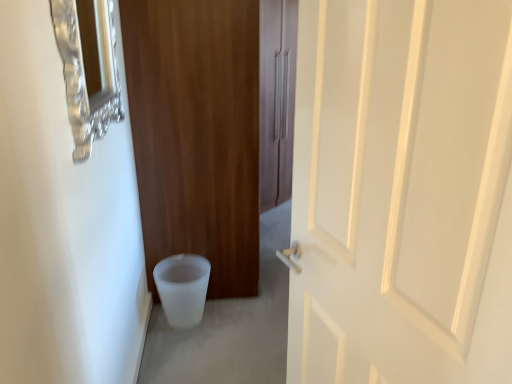
Question: Can you confirm if white frosted toilet bowl at lower left is smaller than matte wood door at center, acting as the second door starting from the front?

Choices:
 (A) no
 (B) yes

Answer: (B)

Question: Does white frosted toilet bowl at lower left have a greater width compared to matte wood door at center, acting as the first door starting from the back?

Choices:
 (A) no
 (B) yes

Answer: (A)

Question: Can you confirm if white frosted toilet bowl at lower left is bigger than matte wood door at center, acting as the second door starting from the front?

Choices:
 (A) no
 (B) yes

Answer: (A)

Question: Is white frosted toilet bowl at lower left positioned before matte wood door at center, acting as the second door starting from the front?

Choices:
 (A) no
 (B) yes

Answer: (A)

Question: Considering the relative positions of white frosted toilet bowl at lower left and matte wood door at center, acting as the first door starting from the back, in the image provided, is white frosted toilet bowl at lower left behind matte wood door at center, acting as the first door starting from the back,?

Choices:
 (A) no
 (B) yes

Answer: (B)

Question: Looking at the image, does matte wood door at center, acting as the first door starting from the back, seem bigger or smaller compared to white frosted toilet bowl at lower left?

Choices:
 (A) small
 (B) big

Answer: (B)

Question: From a real-world perspective, is matte wood door at center, acting as the first door starting from the back, above or below white frosted toilet bowl at lower left?

Choices:
 (A) below
 (B) above

Answer: (B)

Question: From the image's perspective, is matte wood door at center, acting as the second door starting from the front, above or below white frosted toilet bowl at lower left?

Choices:
 (A) above
 (B) below

Answer: (A)

Question: Is point (220, 279) positioned closer to the camera than point (190, 291)?

Choices:
 (A) farther
 (B) closer

Answer: (A)

Question: Is white matte door at center, which is the 2th door from back to front, spatially inside white frosted toilet bowl at lower left, or outside of it?

Choices:
 (A) inside
 (B) outside

Answer: (B)

Question: In terms of size, does white matte door at center, the 1th door from the front, appear bigger or smaller than white frosted toilet bowl at lower left?

Choices:
 (A) small
 (B) big

Answer: (B)

Question: Considering the positions of white matte door at center, which is the 2th door from back to front, and white frosted toilet bowl at lower left in the image, is white matte door at center, which is the 2th door from back to front, taller or shorter than white frosted toilet bowl at lower left?

Choices:
 (A) short
 (B) tall

Answer: (B)

Question: From the image's perspective, is white matte door at center, which is the 2th door from back to front, positioned above or below white frosted toilet bowl at lower left?

Choices:
 (A) below
 (B) above

Answer: (B)

Question: In terms of size, does brushed metal medicine cabinet at upper left appear bigger or smaller than white frosted toilet bowl at lower left?

Choices:
 (A) big
 (B) small

Answer: (B)

Question: Is brushed metal medicine cabinet at upper left inside or outside of white frosted toilet bowl at lower left?

Choices:
 (A) inside
 (B) outside

Answer: (B)